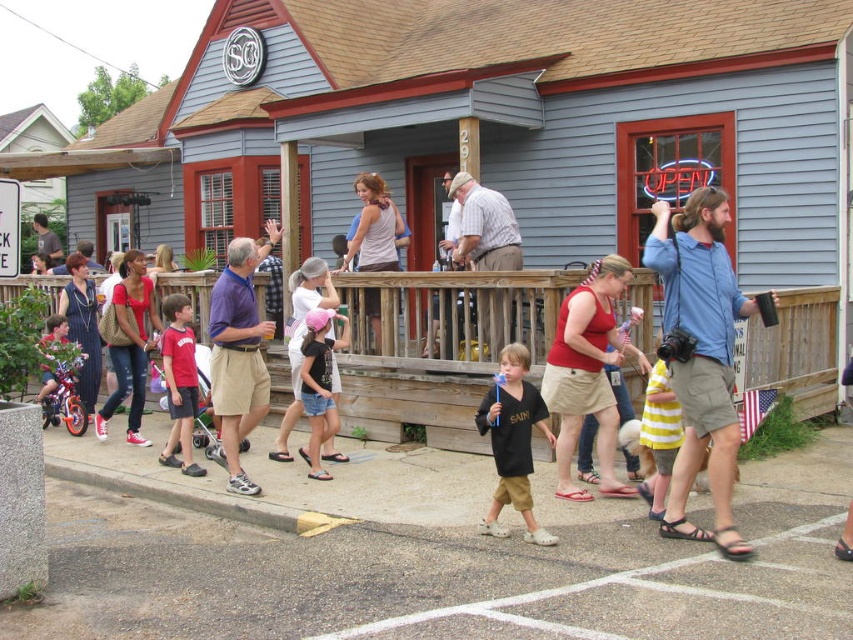
Question: Does matte brown tank top at upper center come behind matte red bicycle at left?

Choices:
 (A) yes
 (B) no

Answer: (A)

Question: Which object appears farthest from the camera in this image?

Choices:
 (A) blue cotton shirt at center
 (B) matte brown tank top at upper center

Answer: (B)

Question: Is wooden at center wider than denim jeans at center?

Choices:
 (A) no
 (B) yes

Answer: (A)

Question: Which of the following is the closest to the observer?

Choices:
 (A) (386, 259)
 (B) (119, 355)
 (C) (701, 445)

Answer: (C)

Question: Considering the relative positions of blue cotton shirt at center and matte brown tank top at upper center in the image provided, where is blue cotton shirt at center located with respect to matte brown tank top at upper center?

Choices:
 (A) left
 (B) right

Answer: (B)

Question: Which of the following is the closest to the observer?

Choices:
 (A) (190, 374)
 (B) (39, 353)

Answer: (B)